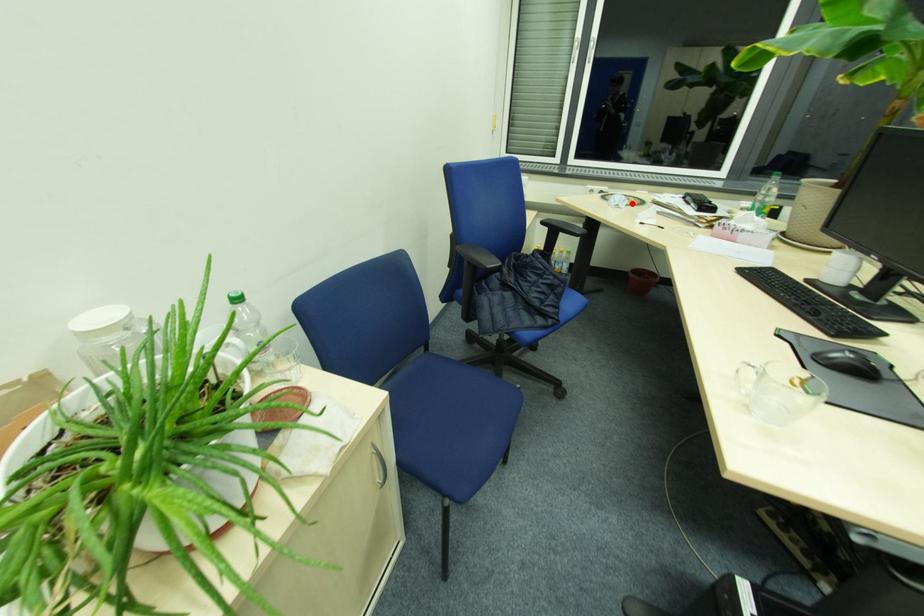
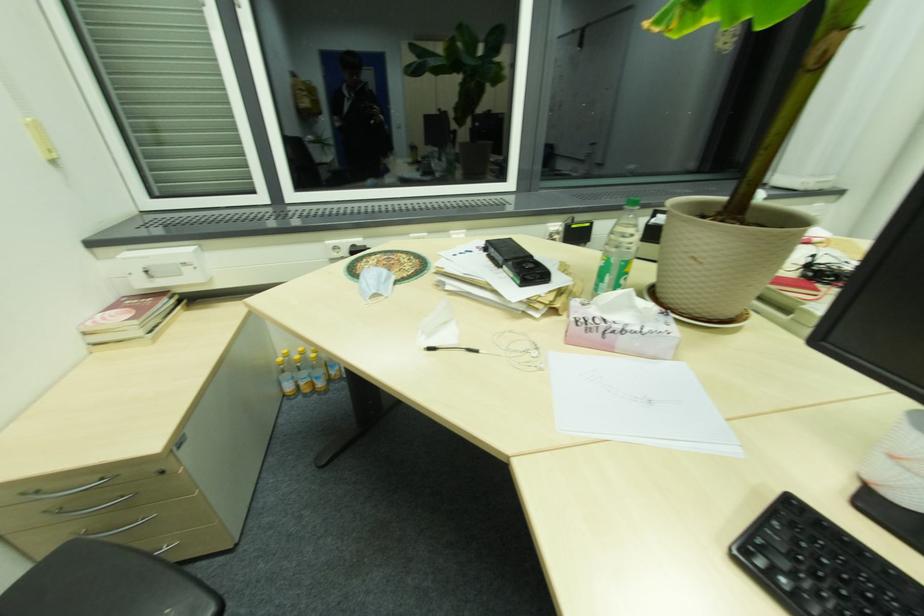
Find the pixel in the second image that matches the highlighted location in the first image.

(397, 280)